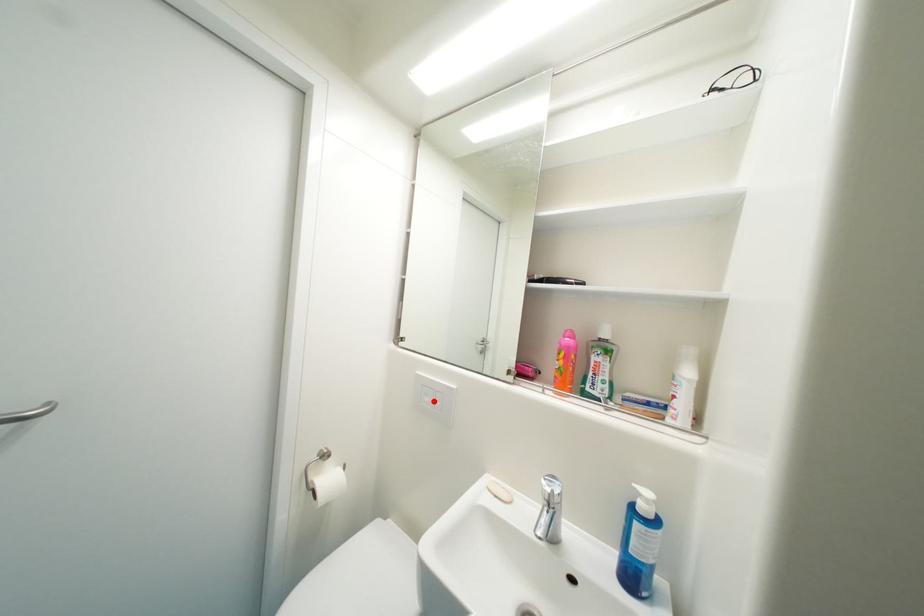
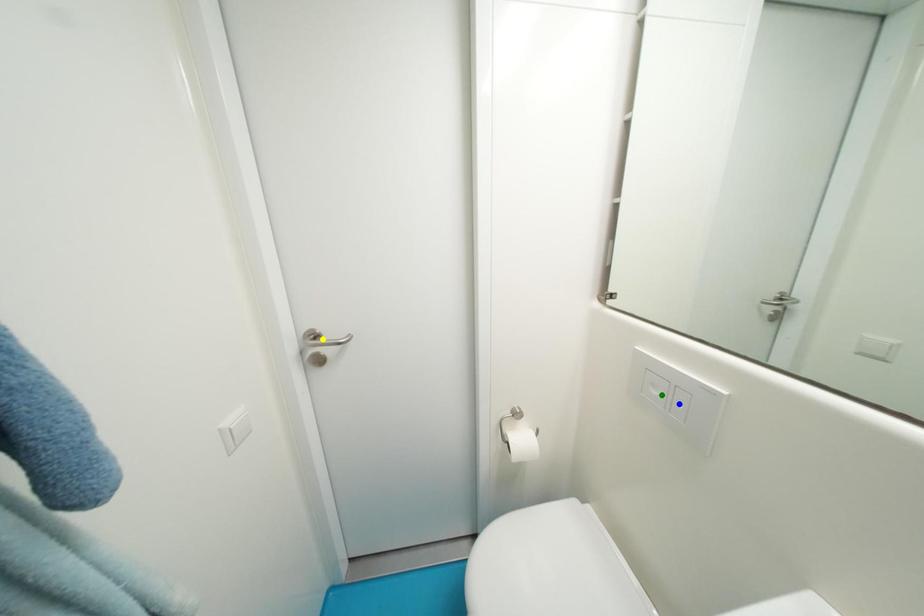
Question: I am providing you with two images of the same scene from different viewpoints. A red point is marked on the first image. You are given multiple points on the second image. Which point in image 2 represents the same 3d spot as the red point in image 1?

Choices:
 (A) blue point
 (B) yellow point
 (C) green point

Answer: (C)